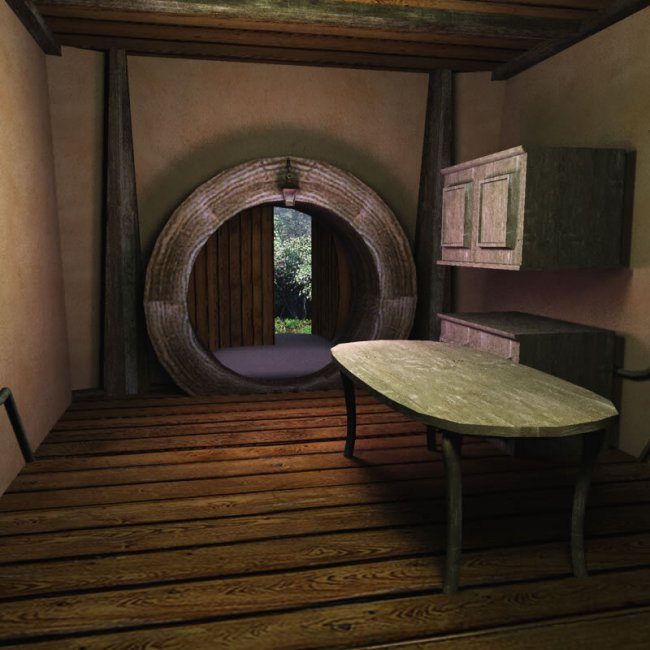
The image size is (650, 650). Identify the location of countertop. (508, 325).